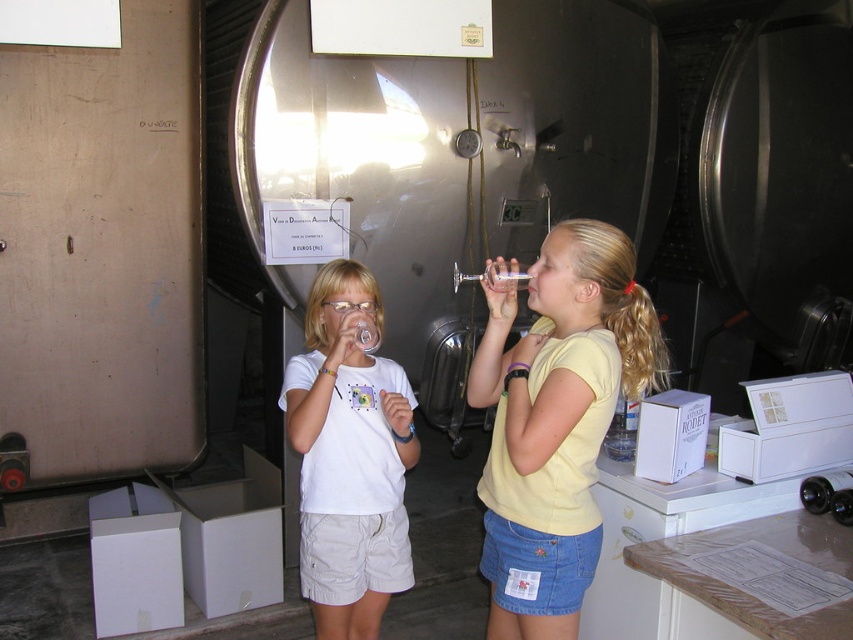
Does yellow matte shirt at center have a lesser height compared to white matte t-shirt at center?

Yes, yellow matte shirt at center is shorter than white matte t-shirt at center.

From the picture: Is yellow matte shirt at center closer to camera compared to white matte t-shirt at center?

Yes, yellow matte shirt at center is in front of white matte t-shirt at center.

Is point (483, 392) positioned before point (392, 440)?

Yes, it is.

Locate an element on the screen. This screenshot has width=853, height=640. yellow matte shirt at center is located at coordinates coord(556,417).